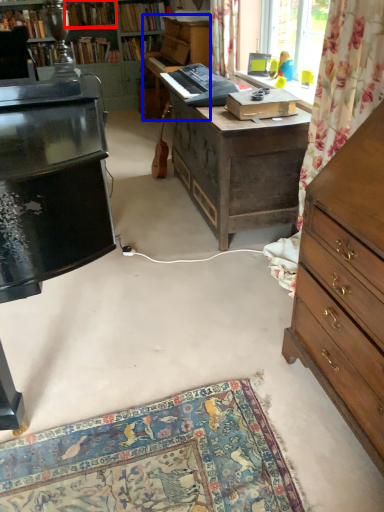
Question: Which object is closer to the camera taking this photo, book (highlighted by a red box) or piano (highlighted by a blue box)?

Choices:
 (A) book
 (B) piano

Answer: (B)